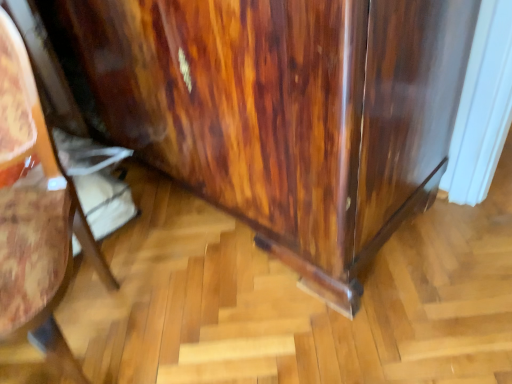
Question: Considering the relative positions of glossy wood dresser at lower right and glossy wood cabinet at lower right in the image provided, is glossy wood dresser at lower right to the right of glossy wood cabinet at lower right from the viewer's perspective?

Choices:
 (A) no
 (B) yes

Answer: (B)

Question: From a real-world perspective, is glossy wood dresser at lower right on top of glossy wood cabinet at lower right?

Choices:
 (A) yes
 (B) no

Answer: (A)

Question: Would you say glossy wood dresser at lower right is a long distance from glossy wood cabinet at lower right?

Choices:
 (A) yes
 (B) no

Answer: (B)

Question: Considering the relative sizes of glossy wood dresser at lower right and glossy wood cabinet at lower right in the image provided, is glossy wood dresser at lower right thinner than glossy wood cabinet at lower right?

Choices:
 (A) no
 (B) yes

Answer: (A)

Question: Considering the relative positions of glossy wood dresser at lower right and glossy wood cabinet at lower right in the image provided, is glossy wood dresser at lower right to the left of glossy wood cabinet at lower right from the viewer's perspective?

Choices:
 (A) yes
 (B) no

Answer: (B)

Question: Is glossy wood dresser at lower right wider than glossy wood cabinet at lower right?

Choices:
 (A) no
 (B) yes

Answer: (B)

Question: Is glossy wood cabinet at lower right smaller than glossy wood dresser at lower right?

Choices:
 (A) no
 (B) yes

Answer: (B)

Question: From a real-world perspective, is glossy wood cabinet at lower right physically above glossy wood dresser at lower right?

Choices:
 (A) no
 (B) yes

Answer: (A)

Question: Can you confirm if glossy wood cabinet at lower right is shorter than glossy wood dresser at lower right?

Choices:
 (A) yes
 (B) no

Answer: (A)

Question: Can you confirm if glossy wood cabinet at lower right is positioned to the right of glossy wood dresser at lower right?

Choices:
 (A) yes
 (B) no

Answer: (B)

Question: Is glossy wood cabinet at lower right aimed at glossy wood dresser at lower right?

Choices:
 (A) no
 (B) yes

Answer: (A)

Question: From the image's perspective, is glossy wood cabinet at lower right below glossy wood dresser at lower right?

Choices:
 (A) no
 (B) yes

Answer: (B)

Question: From a real-world perspective, is glossy wood cabinet at lower right positioned above or below glossy wood dresser at lower right?

Choices:
 (A) below
 (B) above

Answer: (A)